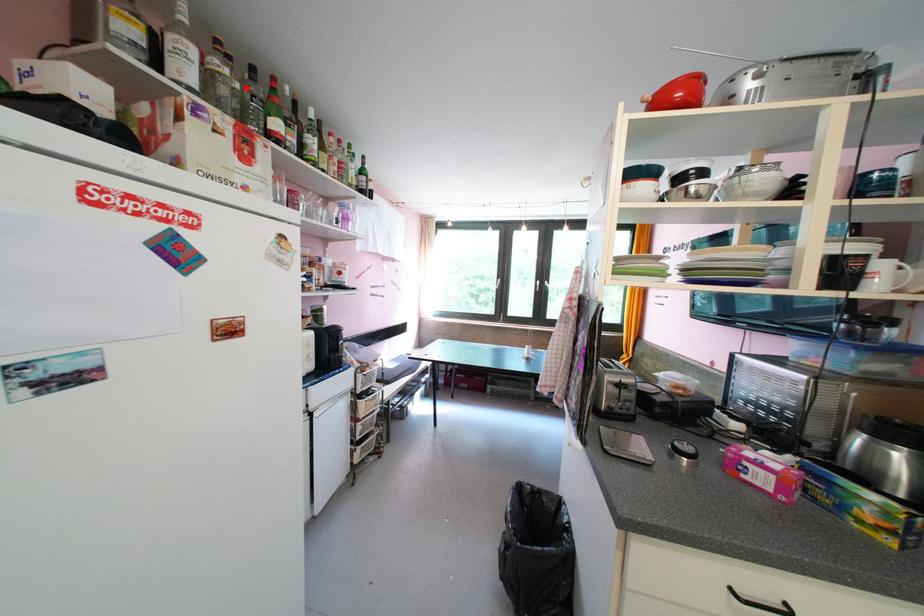
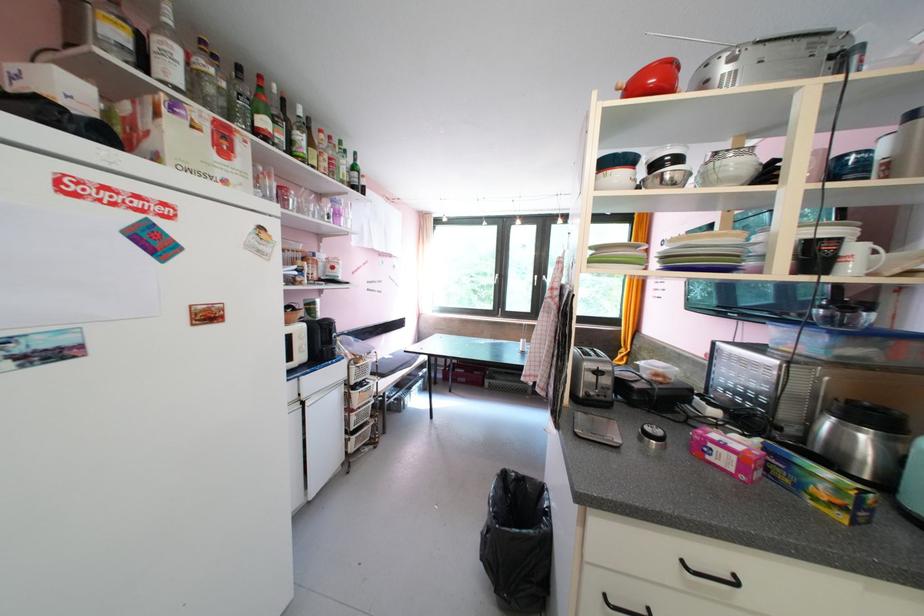
The point at the highlighted location is marked in the first image. Where is the corresponding point in the second image?

(233, 86)